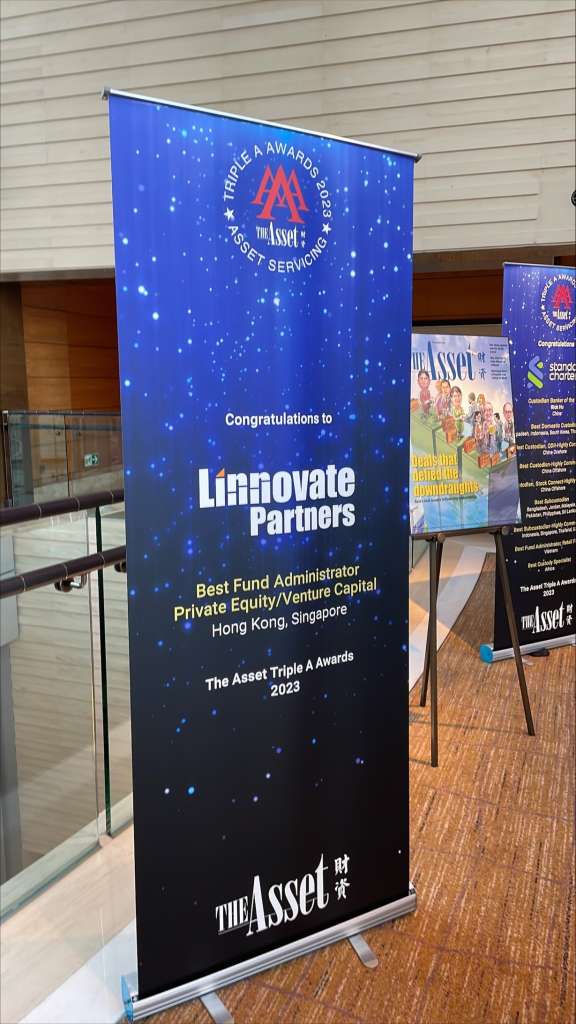
Identify the location of easel. (429, 536).